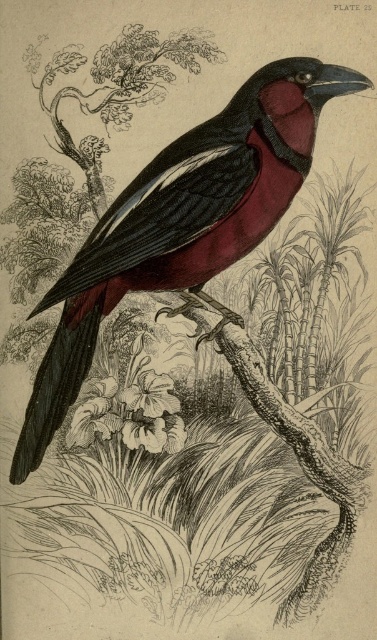
Who is higher up, matte black bird at center or white paper flower at center?

matte black bird at center is above.

Who is taller, matte black bird at center or white paper flower at center?

With more height is matte black bird at center.

You are a GUI agent. You are given a task and a screenshot of the screen. Output one action in this format:
    pyautogui.click(x=<x>, y=<y>)
    Task: Click on the matte black bird at center
    
    Given the screenshot: What is the action you would take?
    pyautogui.click(x=182, y=221)

You are a GUI agent. You are given a task and a screenshot of the screen. Output one action in this format:
    pyautogui.click(x=<x>, y=<y>)
    Task: Click on the matte black bird at center
    
    Given the screenshot: What is the action you would take?
    pyautogui.click(x=182, y=221)